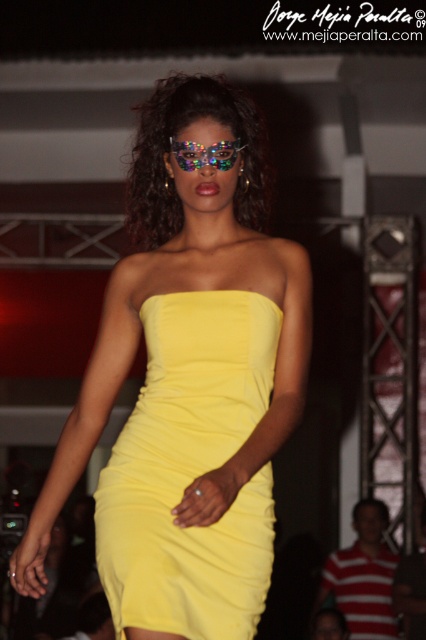
You are standing in a gallery where this fashion show is taking place. You want to take a photo of the model wearing the vibrant yellow strapless dress and her reflective sunglasses. The camera you have can only focus on objects within 2 meters. Will the point at coordinates point (129, 467) be in focus?

The point (129, 467) is 2.86 meters away from the viewer, which is beyond the camera focus range of 2 meters. Therefore, the point will not be in focus.

You are a fashion designer who wants to ensure the holographic plastic goggles at center won not interfere with the yellow matte dress at center when worn. Based on the image, what is the minimum distance you should maintain between the two items?

The minimum distance between the yellow matte dress at center and the holographic plastic goggles at center should be at least 24 inches to ensure they do not interfere with each other.

You are a photographer standing in front of the runway. You see the model wearing two yellow dresses at the center. Which dress is closer to you, the yellow matte dress at center or the yellow satin dress at center?

The yellow matte dress at center is closer to you because it is further to the viewer than the yellow satin dress at center.